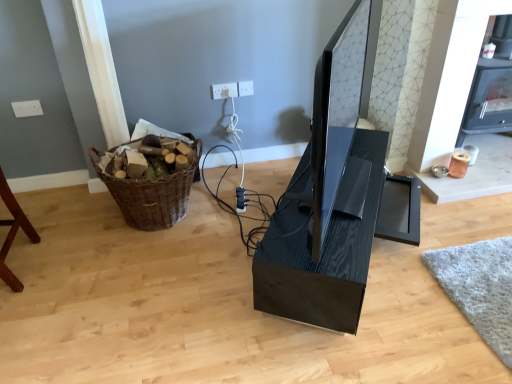
Where is `vacant area located to the right-hand side of woven brown basket at left`? vacant area located to the right-hand side of woven brown basket at left is located at coordinates (243, 206).